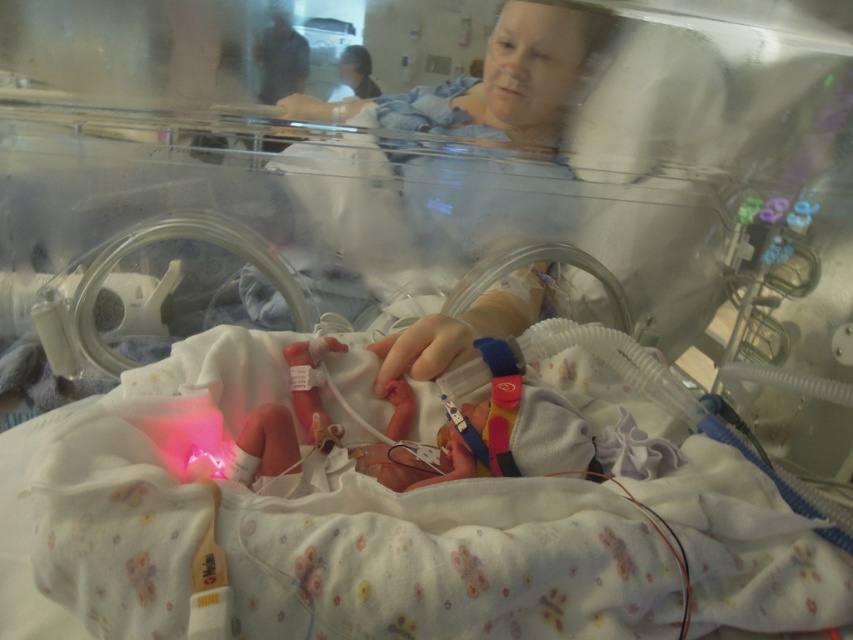
Who is lower down, smooth skin newborn at center or blonde hair at upper center?

Positioned lower is smooth skin newborn at center.

The width and height of the screenshot is (853, 640). Describe the element at coordinates (456, 429) in the screenshot. I see `smooth skin newborn at center` at that location.

This screenshot has height=640, width=853. What are the coordinates of `smooth skin newborn at center` in the screenshot? It's located at (456, 429).

Is point (518, 33) more distant than point (366, 96)?

No, it is in front of (366, 96).

Does matte blue gown at upper center appear on the left side of blonde hair at upper center?

No, matte blue gown at upper center is not to the left of blonde hair at upper center.

This screenshot has width=853, height=640. What do you see at coordinates (495, 83) in the screenshot?
I see `matte blue gown at upper center` at bounding box center [495, 83].

The width and height of the screenshot is (853, 640). Identify the location of matte blue gown at upper center. (495, 83).

Which is in front, point (540, 394) or point (497, 100)?

Point (540, 394) is in front.

Does point (438, 470) come closer to viewer compared to point (537, 36)?

Yes, point (438, 470) is in front of point (537, 36).

Which is in front, point (320, 420) or point (550, 42)?

Point (320, 420) is in front.

What are the coordinates of `smooth skin newborn at center` in the screenshot? It's located at (456, 429).